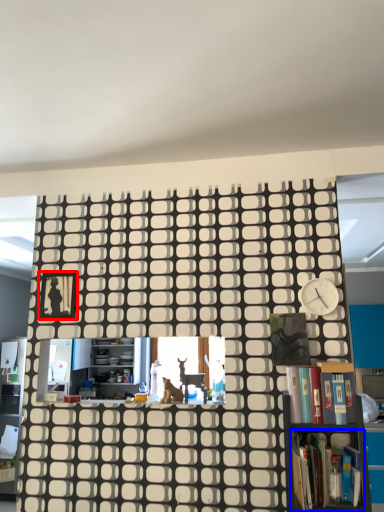
Question: Among these objects, which one is farthest to the camera, picture frame (highlighted by a red box) or book (highlighted by a blue box)?

Choices:
 (A) picture frame
 (B) book

Answer: (A)